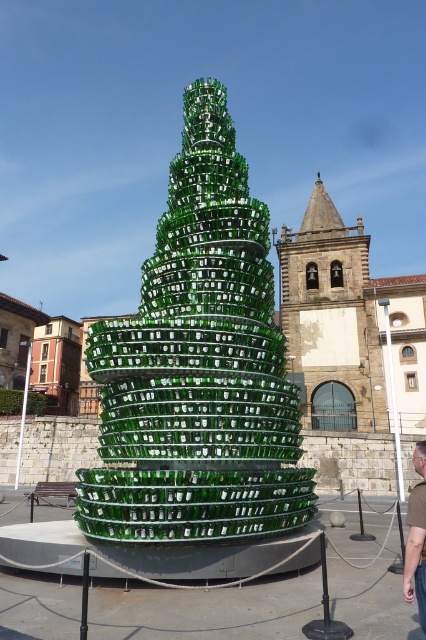
In the scene shown: Does green glass christmas tree at center have a larger size compared to green glass bottle at lower right?

Yes, green glass christmas tree at center is bigger than green glass bottle at lower right.

Who is positioned more to the left, green glass christmas tree at center or green glass bottle at lower right?

From the viewer's perspective, green glass christmas tree at center appears more on the left side.

Locate an element on the screen. green glass christmas tree at center is located at coordinates (198, 365).